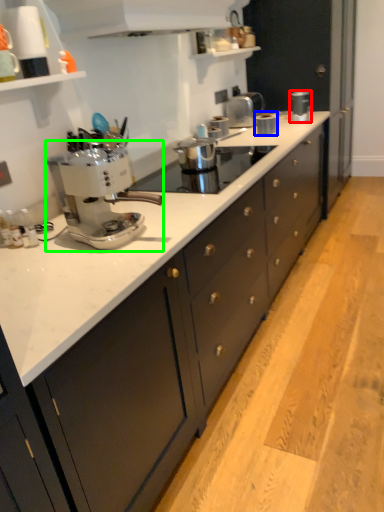
Question: Which object is the closest to the kitchen appliance (highlighted by a red box)? Choose among these: kitchen appliance (highlighted by a blue box) or coffee maker (highlighted by a green box).

Choices:
 (A) kitchen appliance
 (B) coffee maker

Answer: (A)